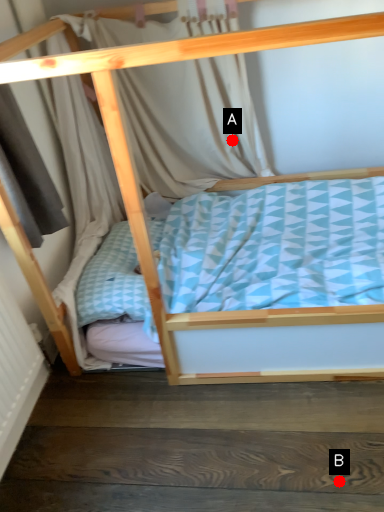
Question: Two points are circled on the image, labeled by A and B beside each circle. Among these points, which one is nearest to the camera?

Choices:
 (A) A is closer
 (B) B is closer

Answer: (B)